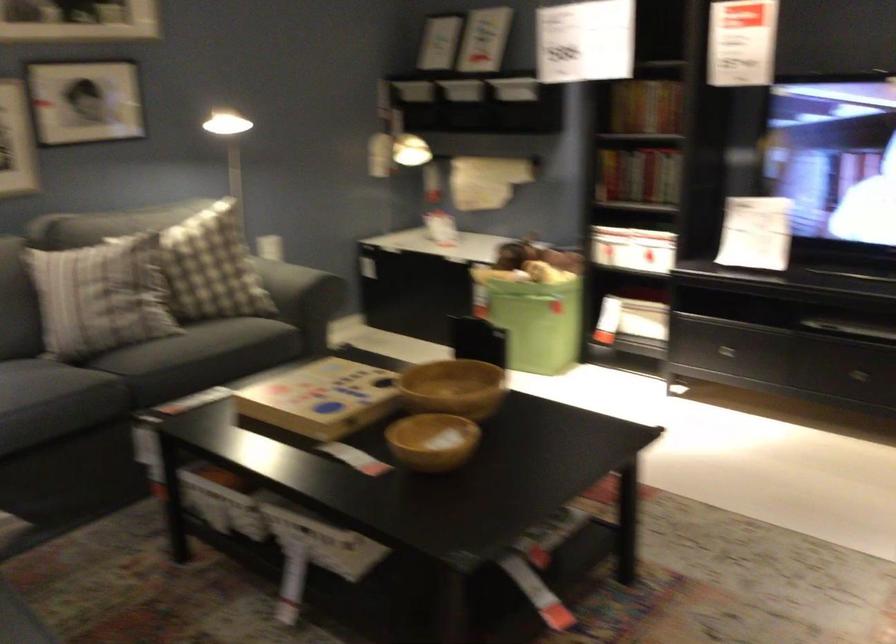
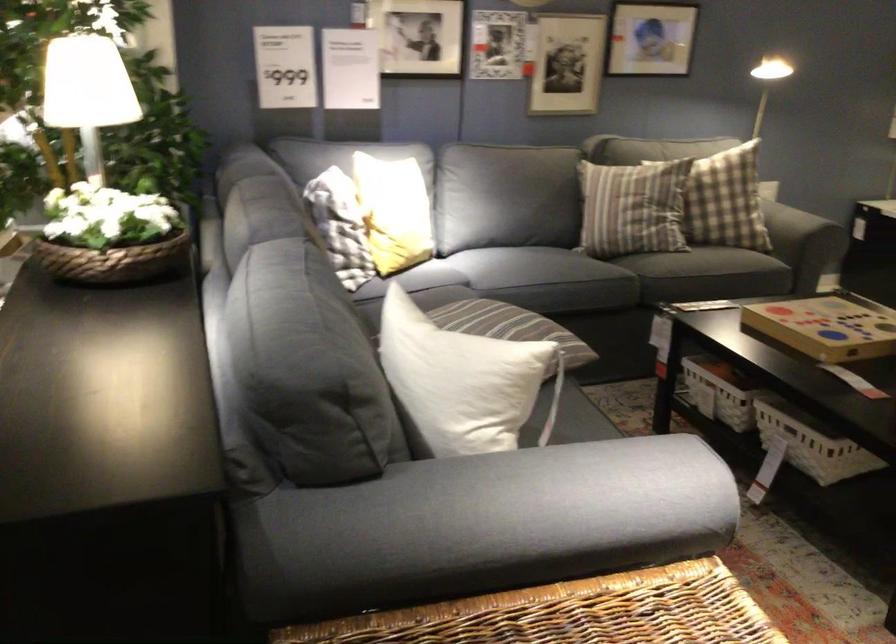
The point at (266, 299) is marked in the first image. Where is the corresponding point in the second image?

(798, 223)